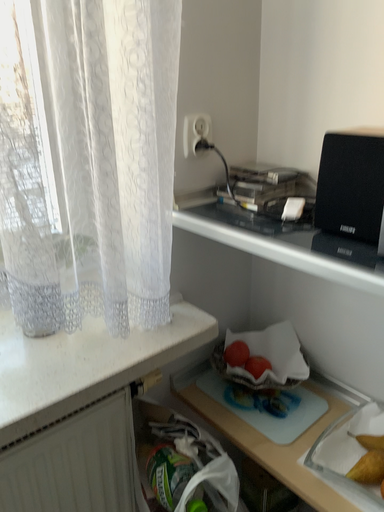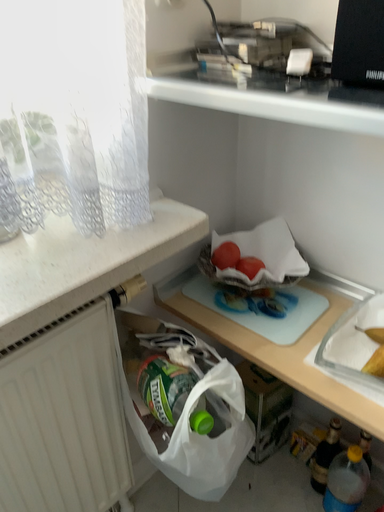
Question: How did the camera likely rotate when shooting the video?

Choices:
 (A) rotated downward
 (B) rotated upward

Answer: (A)